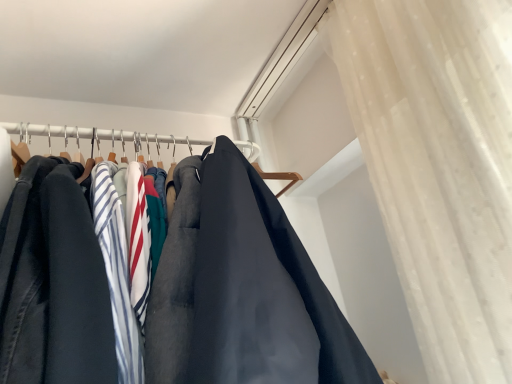
Question: Is dark gray fabric pants at left oriented away from sheer white curtain at upper right?

Choices:
 (A) yes
 (B) no

Answer: (B)

Question: Can you confirm if dark gray fabric pants at left is positioned to the left of sheer white curtain at upper right?

Choices:
 (A) no
 (B) yes

Answer: (B)

Question: Would you consider dark gray fabric pants at left to be distant from sheer white curtain at upper right?

Choices:
 (A) no
 (B) yes

Answer: (A)

Question: Can you confirm if dark gray fabric pants at left is thinner than sheer white curtain at upper right?

Choices:
 (A) no
 (B) yes

Answer: (B)

Question: Is dark gray fabric pants at left taller than sheer white curtain at upper right?

Choices:
 (A) yes
 (B) no

Answer: (B)

Question: Is dark gray fabric pants at left in contact with sheer white curtain at upper right?

Choices:
 (A) no
 (B) yes

Answer: (A)

Question: From the image's perspective, would you say sheer white curtain at upper right is positioned over dark gray fabric pants at left?

Choices:
 (A) no
 (B) yes

Answer: (B)

Question: Does sheer white curtain at upper right have a greater height compared to dark gray fabric pants at left?

Choices:
 (A) no
 (B) yes

Answer: (B)

Question: Is sheer white curtain at upper right completely or partially outside of dark gray fabric pants at left?

Choices:
 (A) no
 (B) yes

Answer: (B)

Question: Considering the relative positions of sheer white curtain at upper right and dark gray fabric pants at left in the image provided, is sheer white curtain at upper right to the left of dark gray fabric pants at left from the viewer's perspective?

Choices:
 (A) no
 (B) yes

Answer: (A)

Question: Is sheer white curtain at upper right positioned with its back to dark gray fabric pants at left?

Choices:
 (A) yes
 (B) no

Answer: (B)

Question: Is sheer white curtain at upper right far from dark gray fabric pants at left?

Choices:
 (A) no
 (B) yes

Answer: (A)

Question: Looking at the image, does dark gray fabric pants at left seem bigger or smaller compared to sheer white curtain at upper right?

Choices:
 (A) small
 (B) big

Answer: (A)